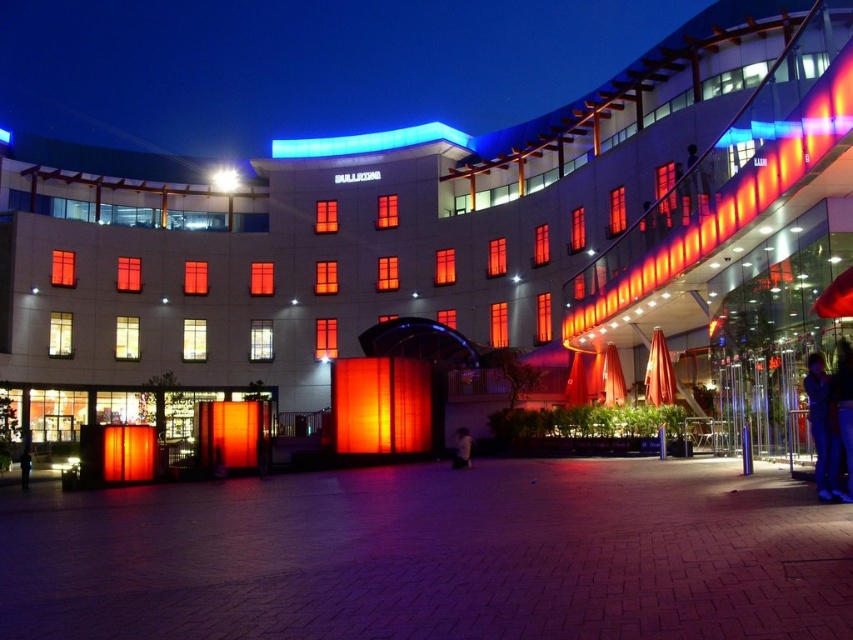
Between blue jeans at lower right and dark blue jeans at lower left, which one is positioned lower?

Positioned lower is dark blue jeans at lower left.

Is blue jeans at lower right wider than dark blue jeans at lower left?

Incorrect, blue jeans at lower right's width does not surpass dark blue jeans at lower left's.

Which is behind, point (837, 429) or point (24, 456)?

The point (24, 456) is more distant.

Where is `blue jeans at lower right`? blue jeans at lower right is located at coordinates click(824, 426).

From the picture: Can you confirm if blue jeans at lower right is positioned to the left of dark blue jeans at lower center?

Incorrect, blue jeans at lower right is not on the left side of dark blue jeans at lower center.

Is point (807, 380) positioned in front of point (451, 460)?

Yes, point (807, 380) is closer to viewer.

Find the location of a particular element. blue jeans at lower right is located at coordinates (824, 426).

Between matte orange neon at upper right and dark blue jeans at lower center, which one appears on the left side from the viewer's perspective?

dark blue jeans at lower center is more to the left.

Which is above, matte orange neon at upper right or dark blue jeans at lower center?

matte orange neon at upper right is higher up.

This screenshot has height=640, width=853. What do you see at coordinates (732, 200) in the screenshot? I see `matte orange neon at upper right` at bounding box center [732, 200].

In order to click on matte orange neon at upper right in this screenshot , I will do `click(732, 200)`.